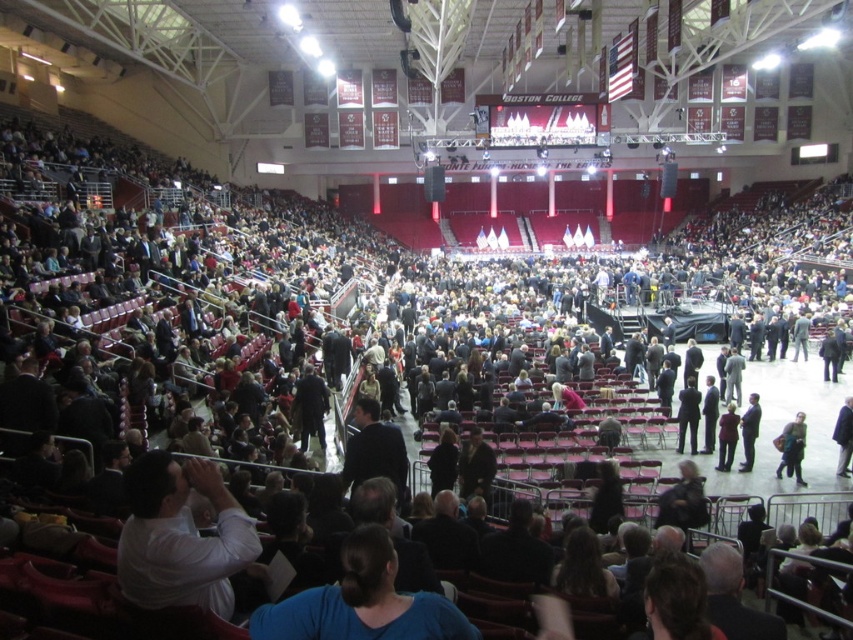
You are standing at the back of the arena and want to take a photo of the stage. There are two points marked in the image. One is at coordinates point (x=257, y=550) and the other is at point (x=788, y=444). Which point will appear closer to you in the photo?

Point (x=257, y=550) is closer to the camera than point (x=788, y=444), so it will appear closer to you in the photo.

You are a photographer positioned at the back of the arena, and you need to capture a clear photo of the white shirt at lower left and dark gray fabric jacket at lower right. Which one of these two items will appear larger in the photo?

The white shirt at lower left will appear larger in the photo because it is taller than the dark gray fabric jacket at lower right.

You are a photographer positioned at the back of the arena. You need to capture a photo of the white shirt at lower left and the dark gray fabric jacket at lower right in the same frame. Based on their positions, will both items be visible in your shot if you aim your camera downward?

The white shirt at lower left is above the dark gray fabric jacket at lower right, so aiming downward would allow both items to be visible in the frame as they are vertically aligned with the white shirt positioned higher up.